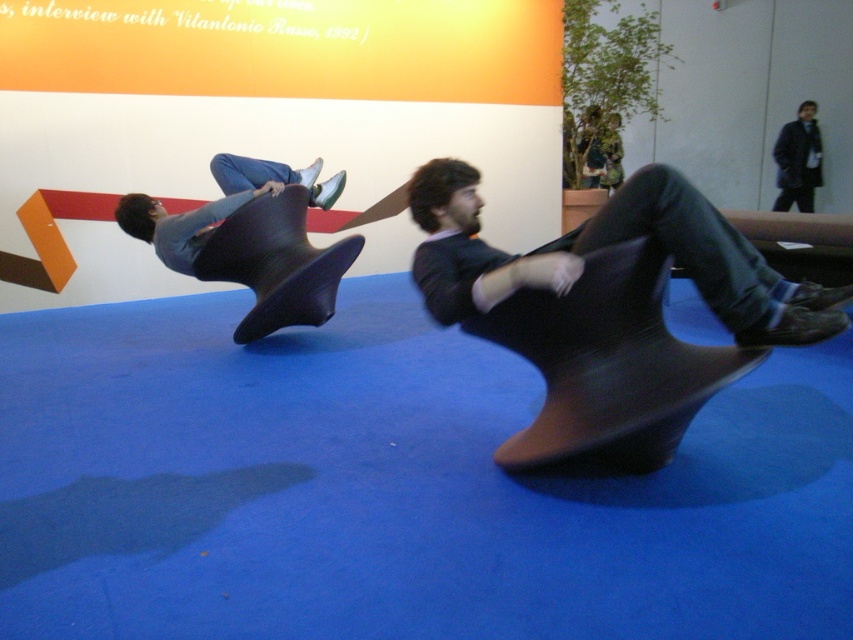
Question: Can you confirm if matte black chair at center is smaller than matte black chair at left?

Choices:
 (A) yes
 (B) no

Answer: (A)

Question: From the image, what is the correct spatial relationship of matte black chair at center in relation to matte black chair at left?

Choices:
 (A) below
 (B) above

Answer: (A)

Question: Which point is closer to the camera?

Choices:
 (A) matte black chair at center
 (B) matte black chair at left

Answer: (A)

Question: Can you confirm if matte black chair at center is bigger than matte black chair at left?

Choices:
 (A) no
 (B) yes

Answer: (A)

Question: Which point is closer to the camera?

Choices:
 (A) matte black chair at center
 (B) matte black chair at left

Answer: (A)

Question: Which point is closer to the camera?

Choices:
 (A) matte black chair at left
 (B) matte black chair at center

Answer: (B)